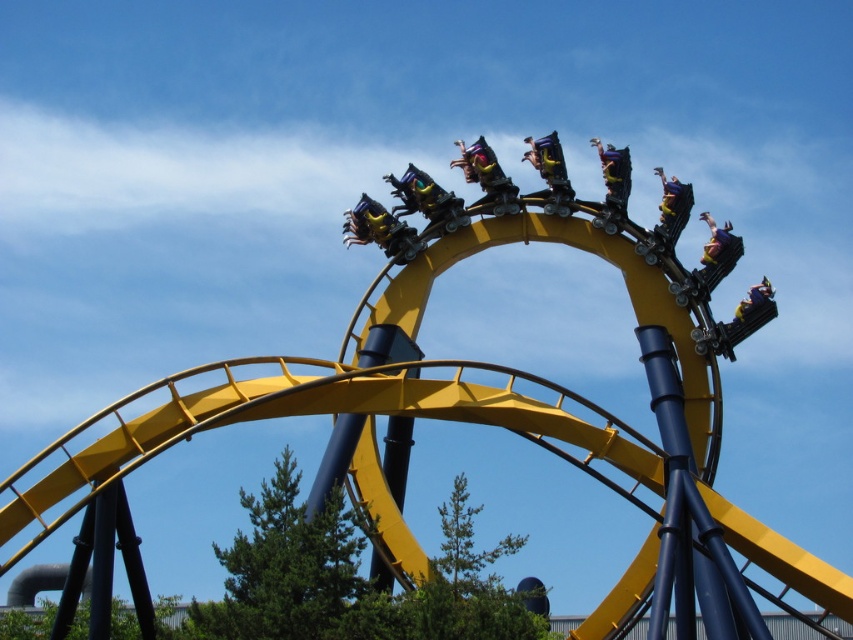
Between point (608, 154) and point (675, 211), which one is positioned in front?

Point (675, 211)

Image resolution: width=853 pixels, height=640 pixels. What do you see at coordinates (614, 172) in the screenshot? I see `matte yellow helmet at upper center` at bounding box center [614, 172].

Which is behind, point (601, 147) or point (682, 188)?

Point (601, 147)

Locate an element on the screen. matte yellow helmet at upper center is located at coordinates (614, 172).

Is yellow matte roller coaster car at upper right positioned behind metallic yellow roller coaster car at upper right?

Yes, yellow matte roller coaster car at upper right is behind metallic yellow roller coaster car at upper right.

Does point (709, 262) come closer to viewer compared to point (665, 186)?

Yes, it is in front of point (665, 186).

Where is `yellow matte roller coaster car at upper right`? This screenshot has width=853, height=640. yellow matte roller coaster car at upper right is located at coordinates (715, 240).

Does matte yellow helmet at upper center appear over yellow matte roller coaster car at upper right?

Yes.

In order to click on matte yellow helmet at upper center in this screenshot , I will do `click(614, 172)`.

Identify the location of matte yellow helmet at upper center. This screenshot has height=640, width=853. (614, 172).